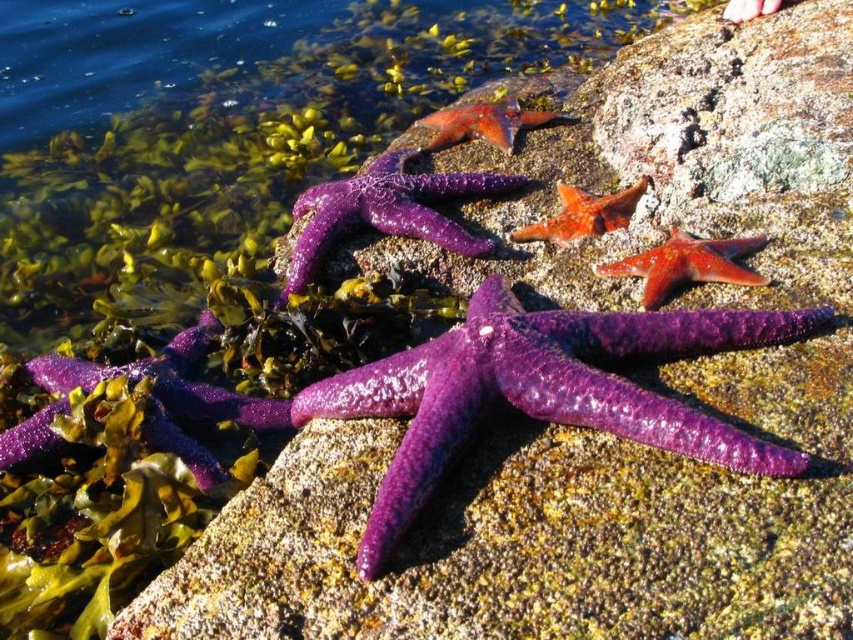
You are a marine biologist examining the starfish in the image. You need to determine if the purple shiny starfish at center can fit into a container designed for the smooth red starfish at center. Can it fit based on their sizes?

The purple shiny starfish at center might be wider than the smooth red starfish at center, so it may not fit into the container designed for the smooth red starfish at center.